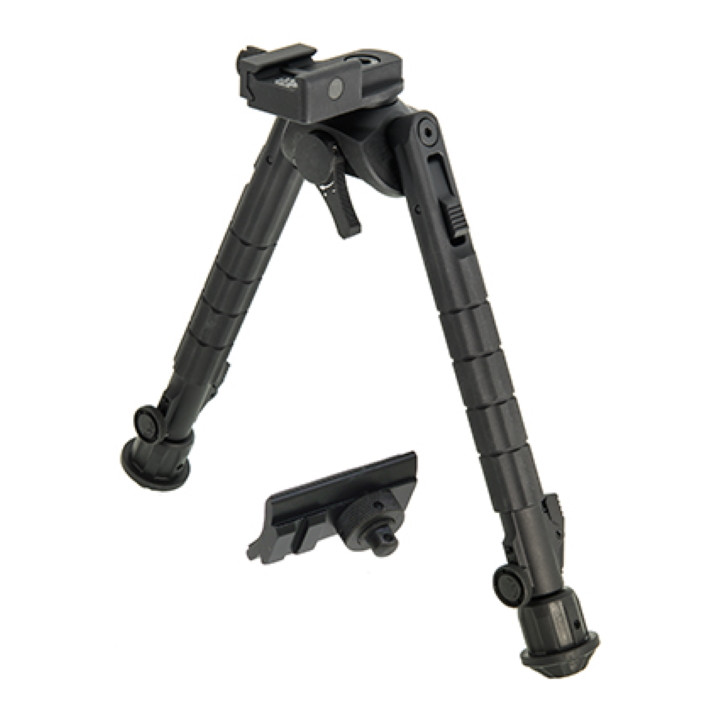
Image resolution: width=720 pixels, height=720 pixels. I want to click on lock, so click(554, 518).